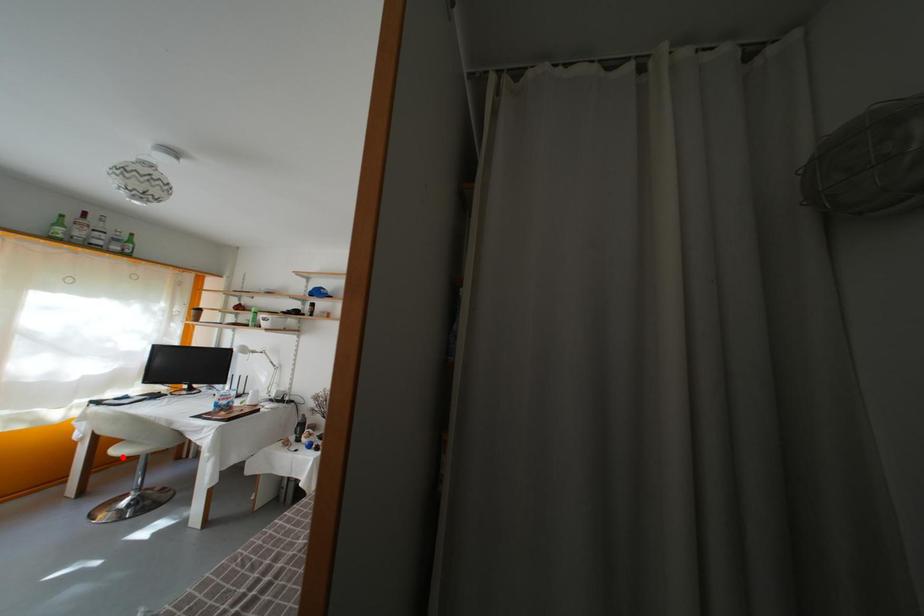
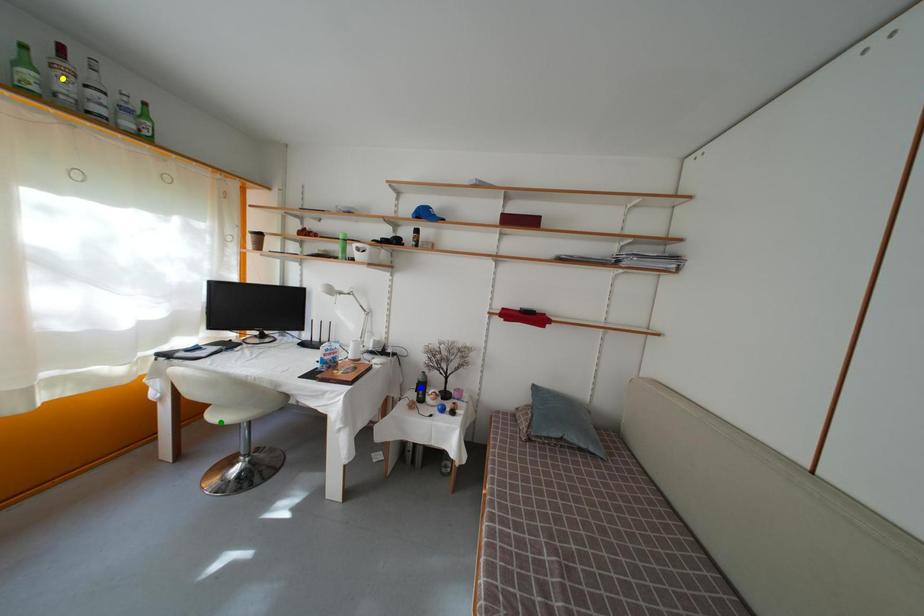
Question: I am providing you with two images of the same scene from different viewpoints. A red point is marked on the first image. You are given multiple points on the second image. Which point in image 2 represents the same 3d spot as the red point in image 1?

Choices:
 (A) green point
 (B) yellow point
 (C) blue point

Answer: (A)